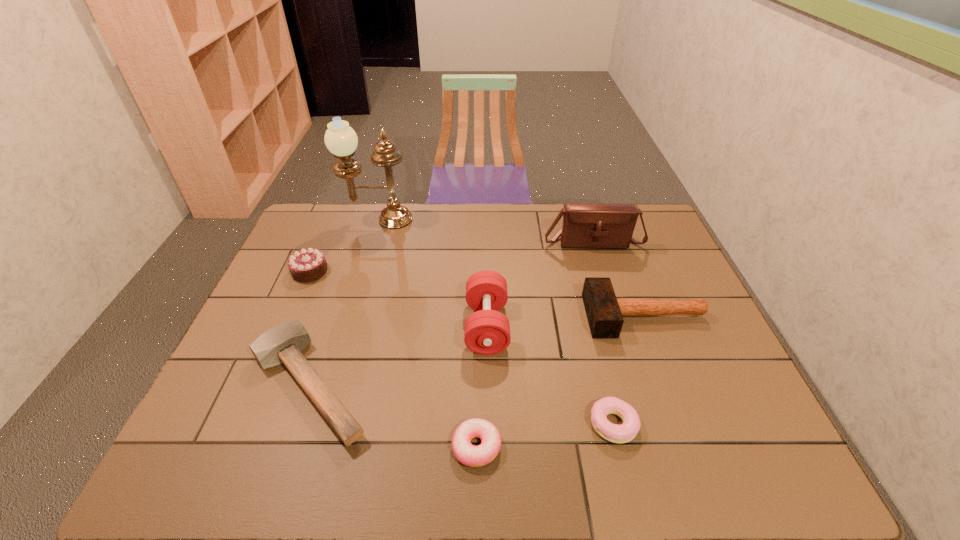
Where is `the farthest object`? the farthest object is located at coordinates (340, 139).

You are a GUI agent. You are given a task and a screenshot of the screen. Output one action in this format:
    pyautogui.click(x=<x>, y=<y>)
    Task: Click on the oil lamp
    The image size is (960, 540).
    Given the screenshot: What is the action you would take?
    tap(340, 139)

Where is `shoulder bag`? The image size is (960, 540). shoulder bag is located at coordinates (585, 225).

Where is `the seventh nearest object`? the seventh nearest object is located at coordinates (585, 225).

Where is `dumbbell`? The height and width of the screenshot is (540, 960). dumbbell is located at coordinates (487, 331).

Locate an element on the screen. This screenshot has height=540, width=960. the sixth nearest object is located at coordinates (307, 265).

Identify the location of the right mallet. (604, 311).

This screenshot has width=960, height=540. I want to click on the left mallet, so click(283, 344).

This screenshot has width=960, height=540. What are the coordinates of `the right doughnut` in the screenshot? It's located at (615, 433).

Locate an element on the screen. the left doughnut is located at coordinates (470, 455).